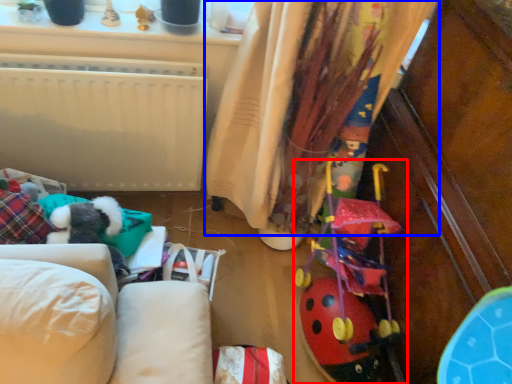
Question: Which object is closer to the camera taking this photo, toy (highlighted by a red box) or curtain (highlighted by a blue box)?

Choices:
 (A) toy
 (B) curtain

Answer: (B)